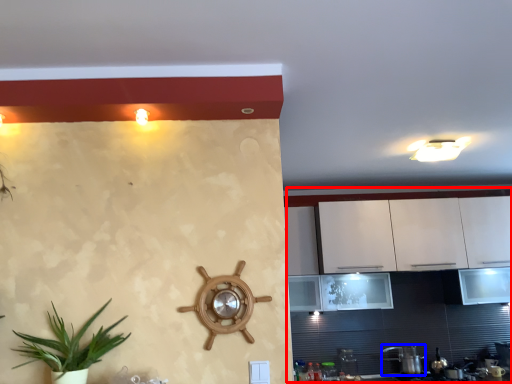
Question: Which point is closer to the camera, dresser (highlighted by a red box) or appliance (highlighted by a blue box)?

Choices:
 (A) dresser
 (B) appliance

Answer: (A)